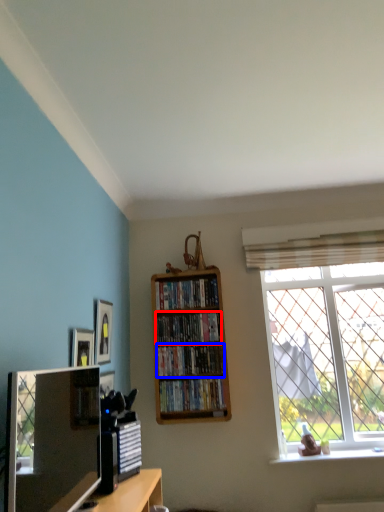
Question: Which object is closer to the camera taking this photo, book (highlighted by a red box) or book (highlighted by a blue box)?

Choices:
 (A) book
 (B) book

Answer: (B)